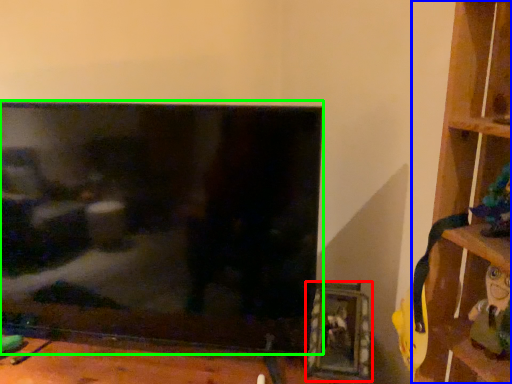
Question: Which object is the farthest from picture frame (highlighted by a red box)? Choose among these: shelf (highlighted by a blue box) or television (highlighted by a green box).

Choices:
 (A) shelf
 (B) television

Answer: (B)